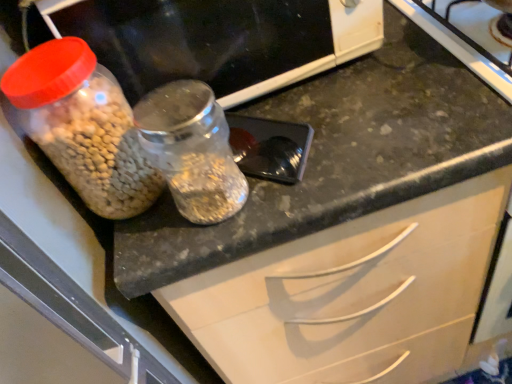
Question: Is translucent plastic jar at left oriented away from translucent plastic jar at left?

Choices:
 (A) no
 (B) yes

Answer: (B)

Question: Does translucent plastic jar at left have a lesser height compared to translucent plastic jar at left?

Choices:
 (A) no
 (B) yes

Answer: (B)

Question: Considering the relative sizes of translucent plastic jar at left and translucent plastic jar at left in the image provided, is translucent plastic jar at left smaller than translucent plastic jar at left?

Choices:
 (A) yes
 (B) no

Answer: (A)

Question: Is translucent plastic jar at left outside translucent plastic jar at left?

Choices:
 (A) no
 (B) yes

Answer: (B)

Question: From the image's perspective, is translucent plastic jar at left under translucent plastic jar at left?

Choices:
 (A) yes
 (B) no

Answer: (A)

Question: Is the depth of translucent plastic jar at left less than that of translucent plastic jar at left?

Choices:
 (A) no
 (B) yes

Answer: (B)

Question: Is metallic black spoon at center to the left of translucent plastic jar at left from the viewer's perspective?

Choices:
 (A) yes
 (B) no

Answer: (B)

Question: Does metallic black spoon at center have a greater height compared to translucent plastic jar at left?

Choices:
 (A) no
 (B) yes

Answer: (A)

Question: From a real-world perspective, is metallic black spoon at center positioned under translucent plastic jar at left based on gravity?

Choices:
 (A) no
 (B) yes

Answer: (B)

Question: From the image's perspective, is metallic black spoon at center beneath translucent plastic jar at left?

Choices:
 (A) yes
 (B) no

Answer: (A)

Question: Is the surface of metallic black spoon at center in direct contact with translucent plastic jar at left?

Choices:
 (A) yes
 (B) no

Answer: (B)

Question: From a real-world perspective, is metallic black spoon at center positioned over translucent plastic jar at left based on gravity?

Choices:
 (A) yes
 (B) no

Answer: (B)

Question: Can you confirm if translucent plastic jar at left is wider than transparent glass jar at center?

Choices:
 (A) yes
 (B) no

Answer: (A)